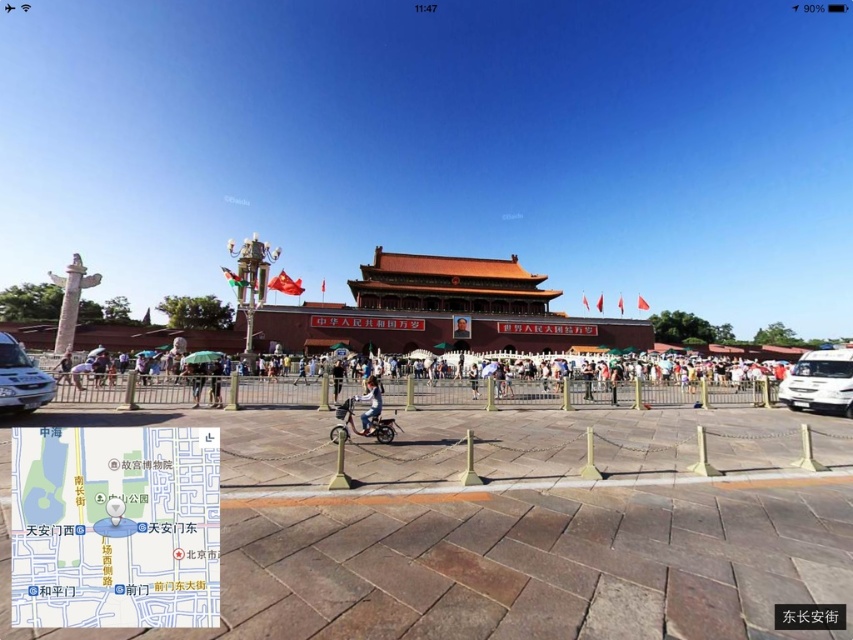
Which is more to the right, matte red building at center or matte black person at center?

From the viewer's perspective, matte black person at center appears more on the right side.

This screenshot has height=640, width=853. What do you see at coordinates (442, 312) in the screenshot?
I see `matte red building at center` at bounding box center [442, 312].

Measure the distance between matte red building at center and camera.

60.14 meters

Locate an element on the screen. matte red building at center is located at coordinates (442, 312).

You are a GUI agent. You are given a task and a screenshot of the screen. Output one action in this format:
    pyautogui.click(x=<x>, y=<y>)
    Task: Click on the white glossy van at right
    The height and width of the screenshot is (640, 853).
    Given the screenshot: What is the action you would take?
    pyautogui.click(x=819, y=381)

From the picture: Which of these two, matte red building at center or light blue denim jacket at center, stands taller?

matte red building at center is taller.

Is matte red building at center positioned at the back of light blue denim jacket at center?

That is True.

Between point (502, 348) and point (358, 413), which one is positioned in front?

Positioned in front is point (358, 413).

Find the location of a particular element. This screenshot has height=640, width=853. matte red building at center is located at coordinates (442, 312).